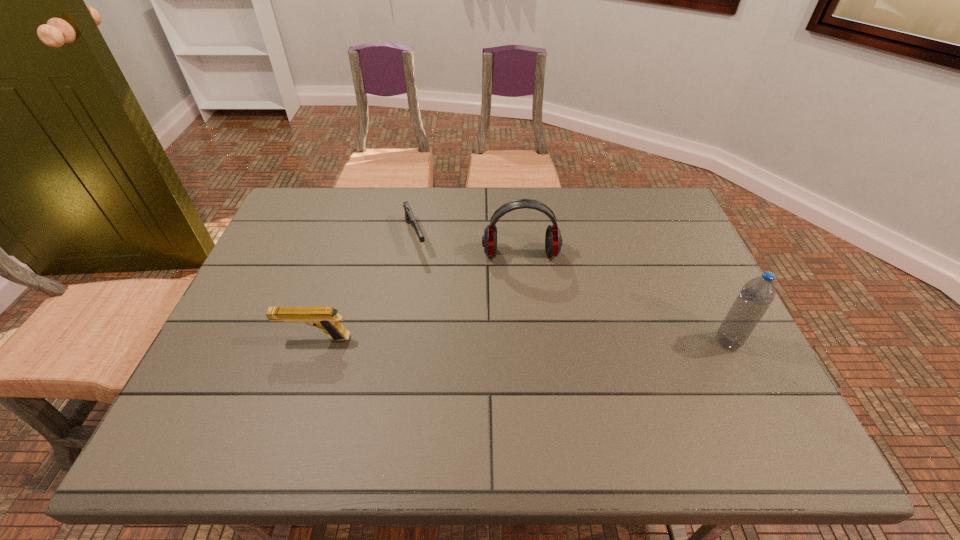
Where is `vacant space located 0.050m at the barrel of the leftmost object`? vacant space located 0.050m at the barrel of the leftmost object is located at coordinates (259, 339).

Image resolution: width=960 pixels, height=540 pixels. I want to click on free space located on the back of the tallest object, so click(681, 245).

The height and width of the screenshot is (540, 960). Find the location of `free point located 0.380m on the ear cups of the second object from right to left`. free point located 0.380m on the ear cups of the second object from right to left is located at coordinates (533, 383).

You are a GUI agent. You are given a task and a screenshot of the screen. Output one action in this format:
    pyautogui.click(x=<x>, y=<y>)
    Task: Click on the vacant point located on the ear cups of the second object from right to left
    The width and height of the screenshot is (960, 540).
    Given the screenshot: What is the action you would take?
    pyautogui.click(x=531, y=364)

Where is `free space located on the ear cups of the second object from right to left`? This screenshot has height=540, width=960. free space located on the ear cups of the second object from right to left is located at coordinates [x=523, y=282].

Identify the location of free space located at the muzzle end of the shortest object. (458, 354).

The width and height of the screenshot is (960, 540). Identify the location of vacant space positioned 0.380m at the muzzle end of the shortest object. (461, 361).

Locate an element on the screen. free spot located 0.230m at the muzzle end of the shortest object is located at coordinates (442, 314).

Identify the location of object present at the far edge. (409, 216).

Locate an element on the screen. The width and height of the screenshot is (960, 540). object present at the left edge is located at coordinates (326, 318).